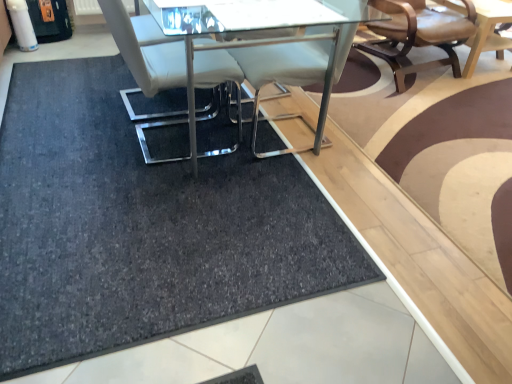
Question: Considering the relative sizes of leather seat at upper right, which appears as the first chair when viewed from the back, and dark gray carpet at center in the image provided, is leather seat at upper right, which appears as the first chair when viewed from the back, shorter than dark gray carpet at center?

Choices:
 (A) no
 (B) yes

Answer: (A)

Question: Considering the relative sizes of leather seat at upper right, the second chair viewed from the front, and dark gray carpet at center in the image provided, is leather seat at upper right, the second chair viewed from the front, bigger than dark gray carpet at center?

Choices:
 (A) yes
 (B) no

Answer: (A)

Question: From the image's perspective, is leather seat at upper right, the second chair viewed from the front, on dark gray carpet at center?

Choices:
 (A) no
 (B) yes

Answer: (B)

Question: From a real-world perspective, is leather seat at upper right, placed as the first chair when sorted from right to left, positioned over dark gray carpet at center based on gravity?

Choices:
 (A) no
 (B) yes

Answer: (B)

Question: Does leather seat at upper right, placed as the first chair when sorted from right to left, appear on the right side of dark gray carpet at center?

Choices:
 (A) no
 (B) yes

Answer: (B)

Question: In the image, is dark gray carpet at center positioned in front of or behind clear glass table at center, which ranks as the first table in front-to-back order?

Choices:
 (A) front
 (B) behind

Answer: (A)

Question: Does point (29, 360) appear closer or farther from the camera than point (173, 16)?

Choices:
 (A) farther
 (B) closer

Answer: (B)

Question: From a real-world perspective, relative to clear glass table at center, placed as the second table when sorted from right to left, is dark gray carpet at center vertically above or below?

Choices:
 (A) below
 (B) above

Answer: (A)

Question: Considering the positions of dark gray carpet at center and clear glass table at center, placed as the second table when sorted from right to left, in the image, is dark gray carpet at center bigger or smaller than clear glass table at center, placed as the second table when sorted from right to left,?

Choices:
 (A) big
 (B) small

Answer: (B)

Question: In the image, is light brown wooden table at upper right, which is counted as the 1th table, starting from the back, positioned in front of or behind clear glass table at center, placed as the second table when sorted from right to left?

Choices:
 (A) behind
 (B) front

Answer: (A)

Question: Which is correct: light brown wooden table at upper right, which is counted as the 1th table, starting from the back, is inside clear glass table at center, marked as the 1th table in a left-to-right arrangement, or outside of it?

Choices:
 (A) outside
 (B) inside

Answer: (A)

Question: In terms of width, does light brown wooden table at upper right, the second table when ordered from front to back, look wider or thinner when compared to clear glass table at center, placed as the second table when sorted from right to left?

Choices:
 (A) thin
 (B) wide

Answer: (B)

Question: Considering the positions of light brown wooden table at upper right, the 1th table positioned from the right, and clear glass table at center, which ranks as the first table in front-to-back order, in the image, is light brown wooden table at upper right, the 1th table positioned from the right, bigger or smaller than clear glass table at center, which ranks as the first table in front-to-back order,?

Choices:
 (A) small
 (B) big

Answer: (A)

Question: Considering the positions of point (182, 51) and point (159, 178), is point (182, 51) closer or farther from the camera than point (159, 178)?

Choices:
 (A) farther
 (B) closer

Answer: (B)

Question: Looking at the image, does white leather chair at center, the first chair when ordered from front to back, seem bigger or smaller compared to dark gray carpet at center?

Choices:
 (A) small
 (B) big

Answer: (B)